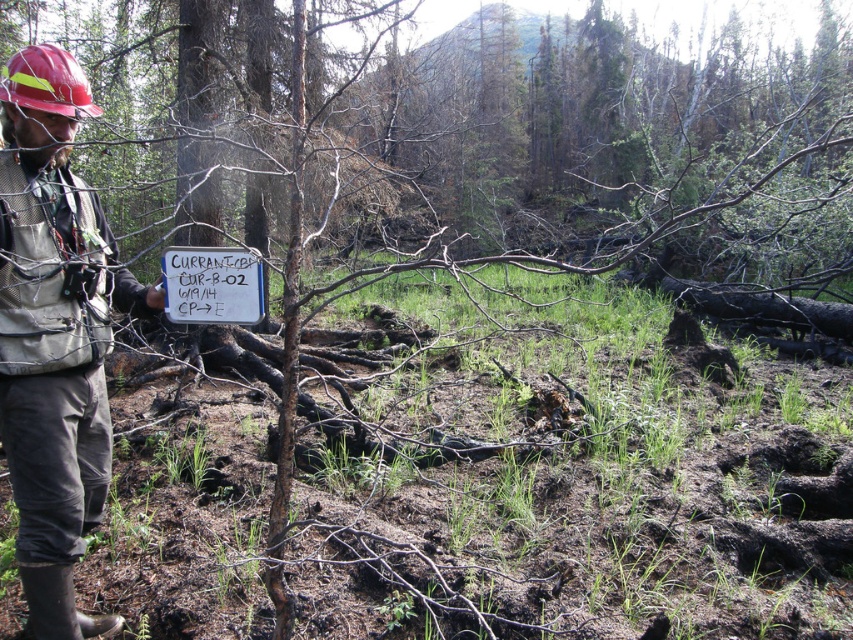
Question: Which point appears closest to the camera in this image?

Choices:
 (A) (67, 97)
 (B) (109, 259)

Answer: (A)

Question: Can you confirm if white paper sign at center is thinner than red hard hat at upper left?

Choices:
 (A) yes
 (B) no

Answer: (B)

Question: Which is nearer to the hard hat at left?

Choices:
 (A) red hard hat at upper left
 (B) white paper sign at center

Answer: (B)

Question: From the image, what is the correct spatial relationship of hard hat at left in relation to white paper sign at center?

Choices:
 (A) left
 (B) right

Answer: (A)

Question: Is white paper sign at center to the left of red hard hat at upper left from the viewer's perspective?

Choices:
 (A) no
 (B) yes

Answer: (A)

Question: Among these points, which one is nearest to the camera?

Choices:
 (A) (x=54, y=45)
 (B) (x=259, y=276)

Answer: (B)